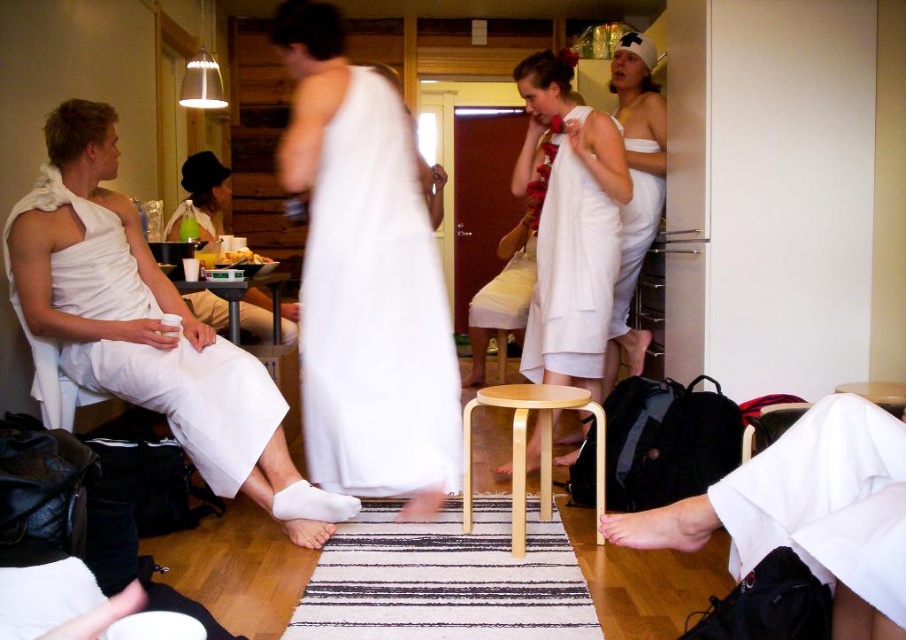
Is white cloth at left to the right of white cotton towel at center from the viewer's perspective?

In fact, white cloth at left is to the left of white cotton towel at center.

Is white cloth at left wider than white cotton towel at center?

Yes, white cloth at left is wider than white cotton towel at center.

Locate an element on the screen. The width and height of the screenshot is (906, 640). white cloth at left is located at coordinates (147, 326).

Can you confirm if white matte dress at center is bigger than white cotton towel at upper right?

Correct, white matte dress at center is larger in size than white cotton towel at upper right.

Is the position of white matte dress at center less distant than that of white cotton towel at upper right?

That is True.

Is point (546, 243) less distant than point (632, 168)?

Yes, it is in front of point (632, 168).

Locate an element on the screen. The image size is (906, 640). white matte dress at center is located at coordinates (574, 243).

Is white cloth at left bigger than white cotton robe at lower right?

Indeed, white cloth at left has a larger size compared to white cotton robe at lower right.

This screenshot has height=640, width=906. What are the coordinates of `white cloth at left` in the screenshot? It's located at pyautogui.click(x=147, y=326).

Describe the element at coordinates (147, 326) in the screenshot. I see `white cloth at left` at that location.

This screenshot has width=906, height=640. I want to click on white cloth at left, so click(x=147, y=326).